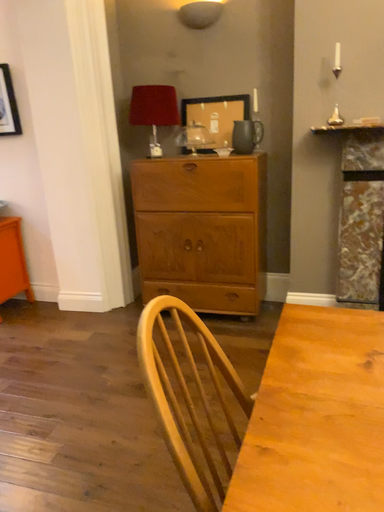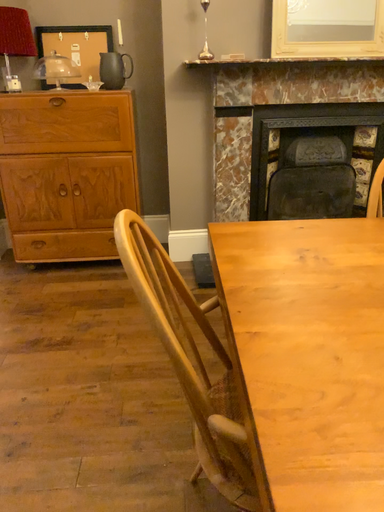
Question: Which way did the camera rotate in the video?

Choices:
 (A) rotated right
 (B) rotated left

Answer: (A)